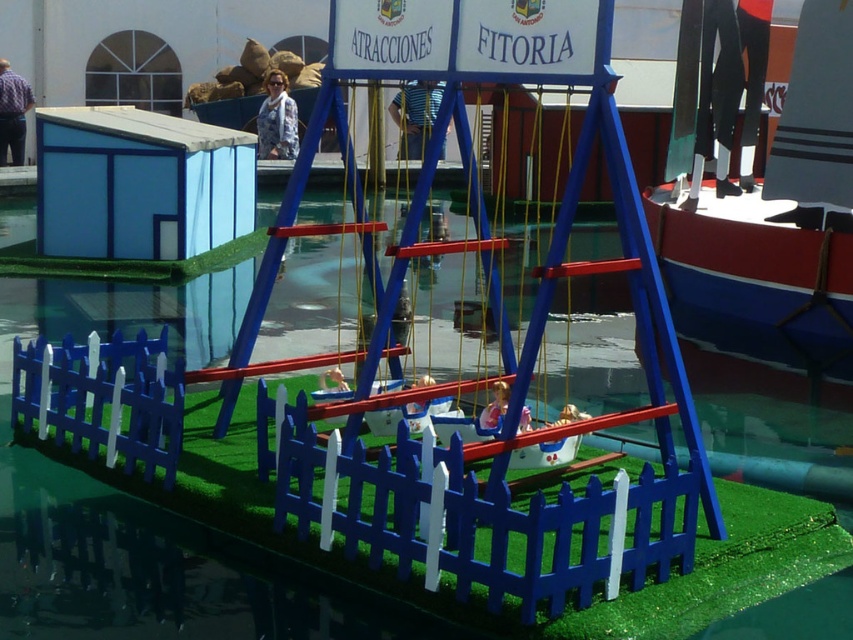
In the scene shown: You are a child playing in the miniature playground and want to reach the blue painted wood picket fence at center. Which direction should you move from your current position at point [480,508]?

The blue painted wood picket fence at center is already at your current position at point [480,508], so you don not need to move.

You are a small toy car trying to drive from the blue painted wood picket fence at center to the matte blue swing at center. Which direction should you move to get closer to the swing?

The blue painted wood picket fence at center is closer to the viewer than the matte blue swing at center, so to move towards the swing, you should drive away from the viewer, moving backward in the scene to reach the matte blue swing at center.